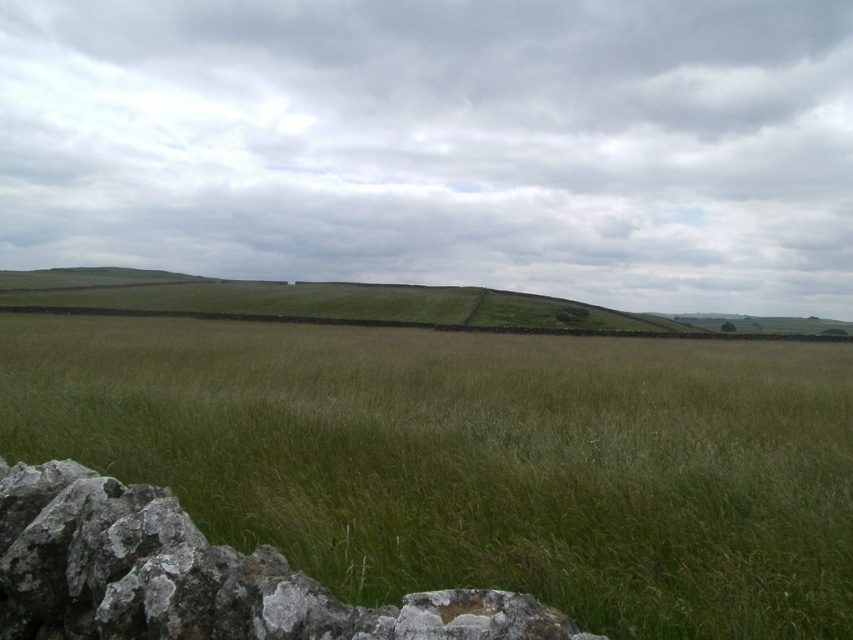
Question: Which point is farther from the camera taking this photo?

Choices:
 (A) (595, 420)
 (B) (323, 310)

Answer: (B)

Question: Is green grassy field at center bigger than gray rough stone at lower left?

Choices:
 (A) yes
 (B) no

Answer: (A)

Question: Which point is farther to the camera?

Choices:
 (A) (572, 412)
 (B) (270, 618)
 (C) (366, 292)

Answer: (C)

Question: Which object is closer to the camera taking this photo?

Choices:
 (A) green grassy hillside at center
 (B) gray rough stone at lower left

Answer: (B)

Question: Is gray rough stone at lower left behind green grassy hillside at center?

Choices:
 (A) no
 (B) yes

Answer: (A)

Question: Can you confirm if green grassy field at center is positioned above gray rough stone at lower left?

Choices:
 (A) no
 (B) yes

Answer: (B)